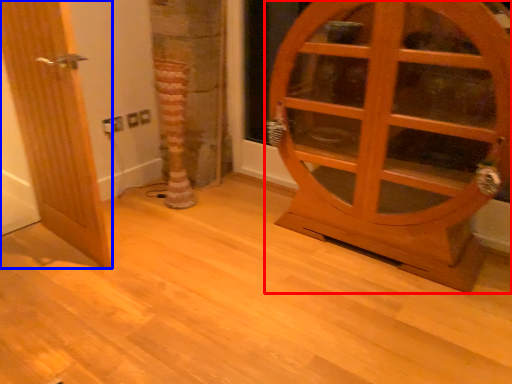
Question: Which of the following is the closest to the observer, door (highlighted by a red box) or door (highlighted by a blue box)?

Choices:
 (A) door
 (B) door

Answer: (A)